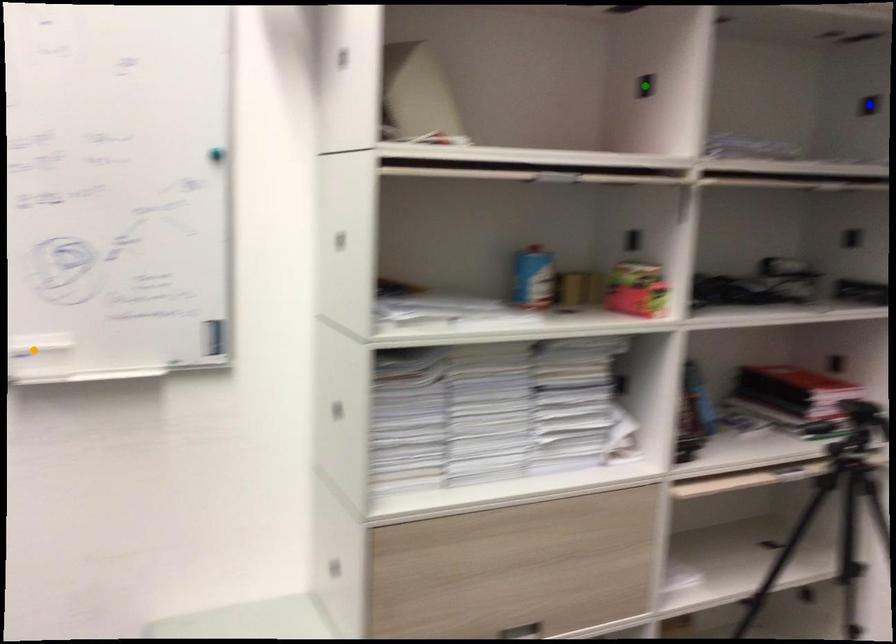
In the scene shown: Order these from nearest to farthest:
1. green point
2. orange point
3. blue point

1. orange point
2. green point
3. blue point